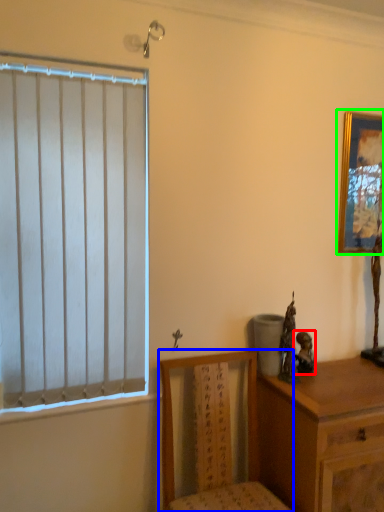
Question: Estimate the real-world distances between objects in this image. Which object is closer to figurine (highlighted by a red box), chair (highlighted by a blue box) or picture frame (highlighted by a green box)?

Choices:
 (A) chair
 (B) picture frame

Answer: (A)